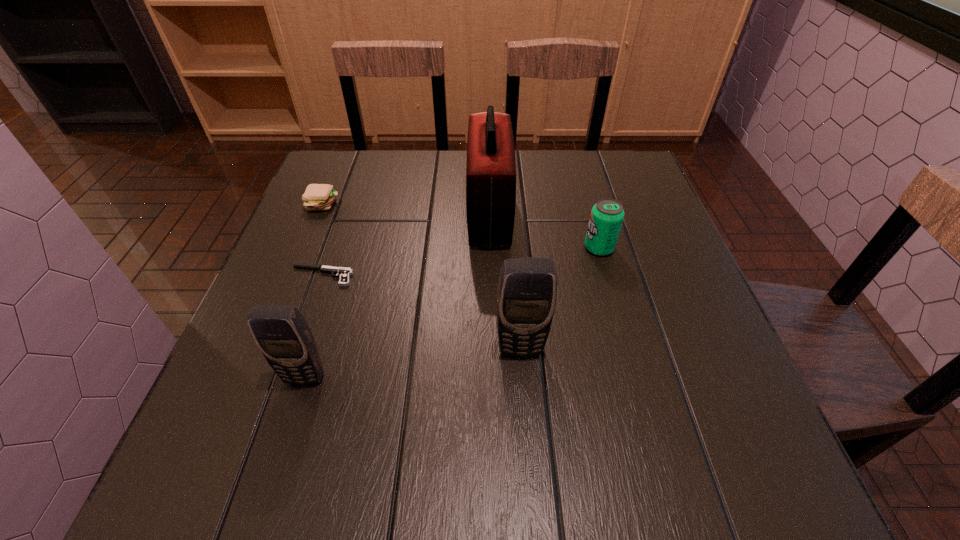
Image resolution: width=960 pixels, height=540 pixels. In order to click on free region at the left edge in this screenshot , I will do `click(319, 227)`.

Find the location of `blank space at the right edge of the desktop`. blank space at the right edge of the desktop is located at coordinates (635, 242).

I want to click on vacant space at the far left corner, so click(x=340, y=195).

I want to click on vacant space at the near left corner of the desktop, so click(x=230, y=393).

In the image, there is a desktop. Identify the location of free space at the far right corner. (600, 185).

In the image, there is a desktop. Where is `free space at the near right corner`? free space at the near right corner is located at coordinates (723, 420).

You are a GUI agent. You are given a task and a screenshot of the screen. Output one action in this format:
    pyautogui.click(x=<x>, y=<y>)
    Task: Click on the vacant space in between the patty and the first aid kit
    The height and width of the screenshot is (540, 960).
    Given the screenshot: What is the action you would take?
    pyautogui.click(x=406, y=210)

Where is `free spot between the fifth tallest object and the rightmost object`? The image size is (960, 540). free spot between the fifth tallest object and the rightmost object is located at coordinates (461, 226).

Identify the location of free space between the left cellular telephone and the farther cellular telephone. (413, 363).

Find the location of a particular element. The height and width of the screenshot is (540, 960). vacant area that lies between the pistol and the farther cellular telephone is located at coordinates (x=421, y=313).